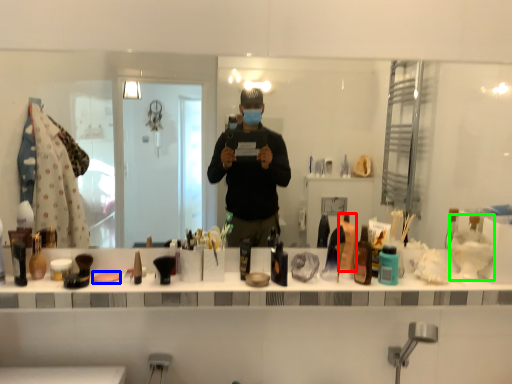
Question: Considering the real-world distances, which object is farthest from toiletry (highlighted by a red box)? soap (highlighted by a blue box) or shaving cream (highlighted by a green box)?

Choices:
 (A) soap
 (B) shaving cream

Answer: (A)